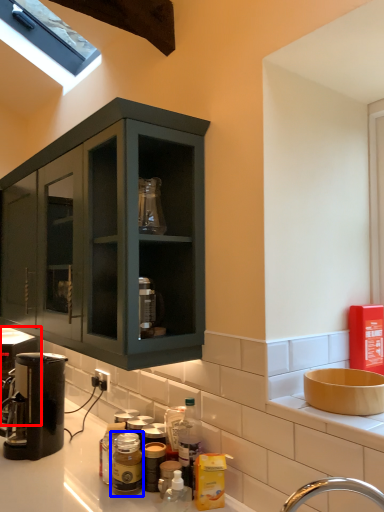
Question: Which point is closer to the camera, coffee machine (highlighted by a red box) or bottle (highlighted by a blue box)?

Choices:
 (A) coffee machine
 (B) bottle

Answer: (B)